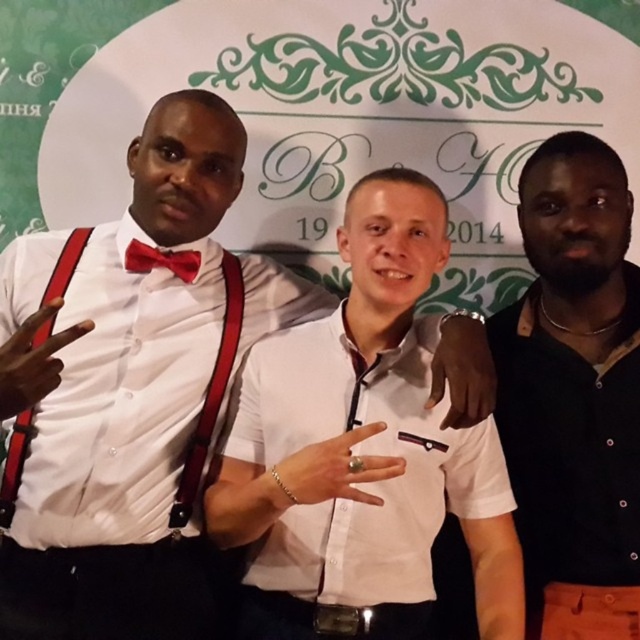
You are standing in front of the backdrop and notice the red leather suspenders at left. Where exactly are they positioned in relation to the central figure?

The red leather suspenders at left are located at coordinates point (x=211, y=394), which places them to the left of the central figure.

You are a photographer setting up for a group photo. You need to ensure that the white matte shirt at center and the black leather jacket at right are both visible in the frame. Based on their heights, which one might require you to adjust the camera angle upwards to capture fully?

The white matte shirt at center is shorter than the black leather jacket at right, so you would need to adjust the camera angle upwards to capture the taller black leather jacket at right fully.